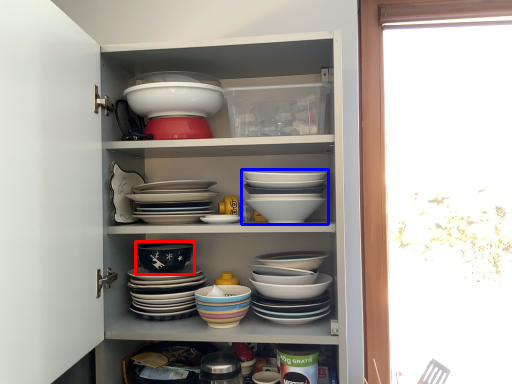
Question: Among these objects, which one is farthest to the camera, bowl (highlighted by a red box) or bowl (highlighted by a blue box)?

Choices:
 (A) bowl
 (B) bowl

Answer: (A)